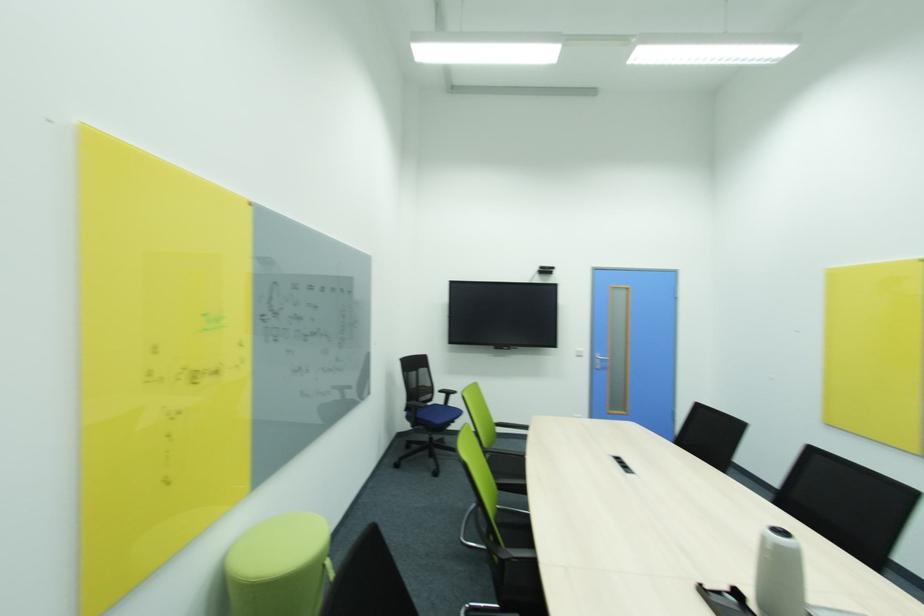
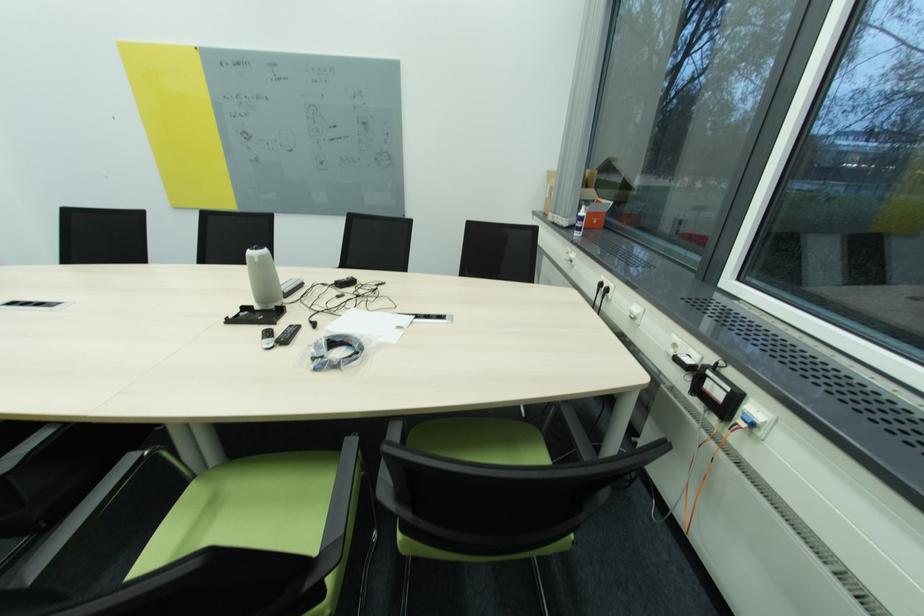
The point at (774,548) is marked in the first image. Where is the corresponding point in the second image?

(261, 262)